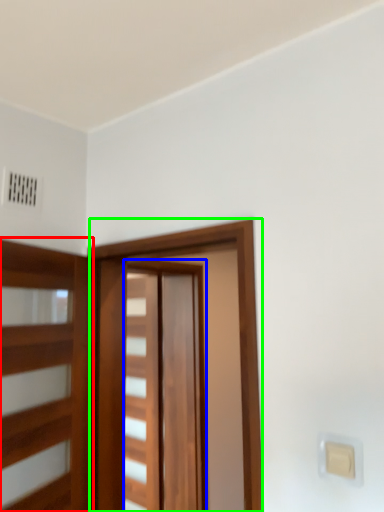
Question: Considering the real-world distances, which object is farthest from elevator (highlighted by a red box)? barn door (highlighted by a blue box) or barn door (highlighted by a green box)?

Choices:
 (A) barn door
 (B) barn door

Answer: (A)